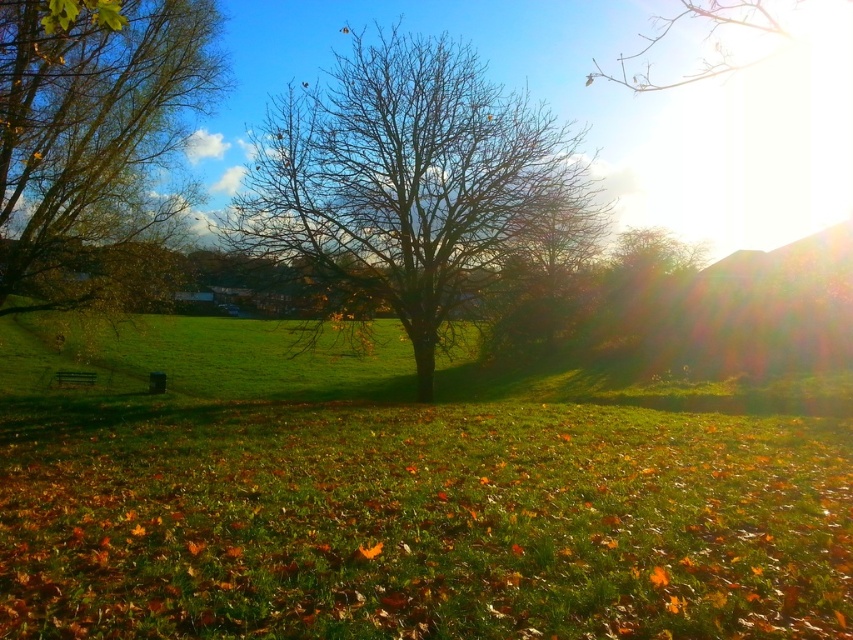
You are an artist setting up your easel to paint the scene. You want to capture the relationship between the bare branches at center and the brown leafy tree at left. Which object should you focus on first if you want to emphasize their size difference?

The bare branches at center should be focused on first because its width is larger than the brown leafy tree at left, making it the dominant feature in terms of size.

You are planning to hang a bird feeder in the tree with the bare branches at center. Since the tree is smaller than the brown leafy tree at left, will the bird feeder be more visible from the ground?

The bare branches at center has a smaller size compared to brown leafy tree at left, so the bird feeder will be more visible from the ground because it is in a smaller tree.

You are standing at the center of the image and want to walk towards the bare branches at center. Which direction should you go?

The bare branches at center are already at the center of the image, so you are already facing them directly. No need to change direction.